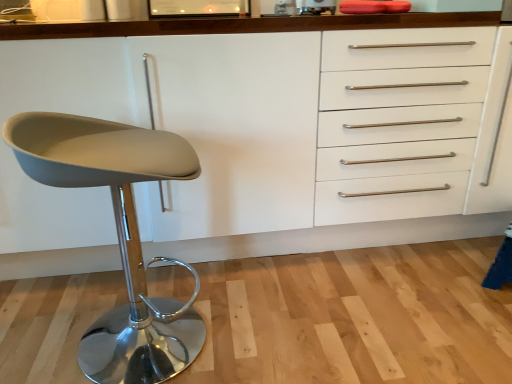
I want to click on free point below matte gray seat at left (from a real-world perspective), so click(132, 365).